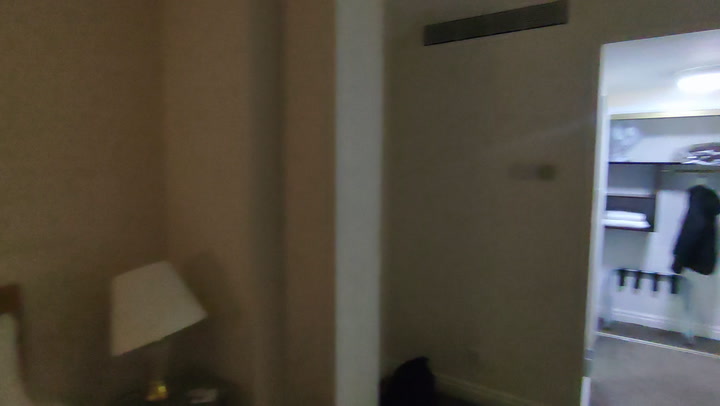
Locate an element on the screen. wooden side table is located at coordinates (222, 390).